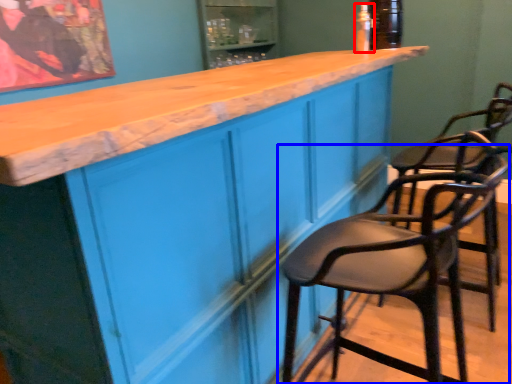
Question: Which object appears farthest to the camera in this image, bottle (highlighted by a red box) or chair (highlighted by a blue box)?

Choices:
 (A) bottle
 (B) chair

Answer: (A)